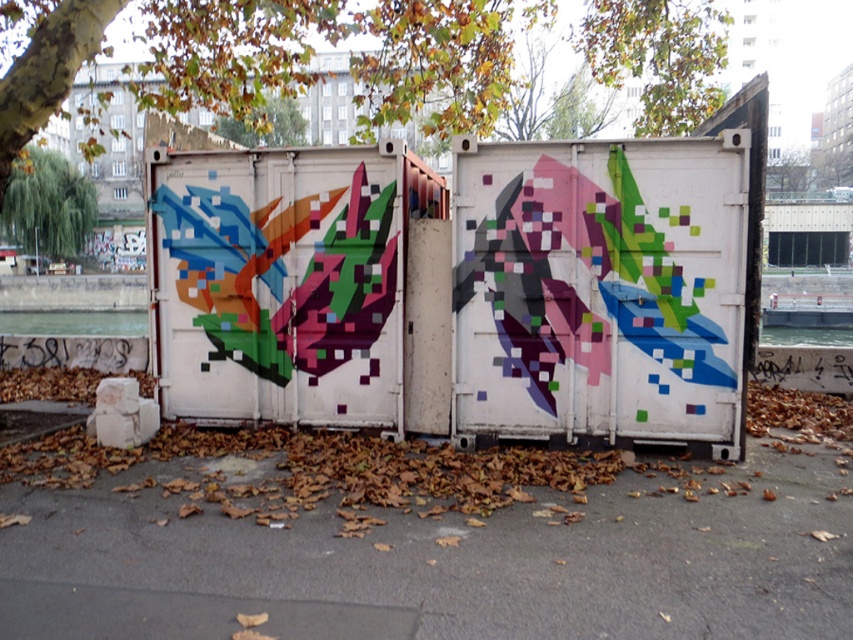
You are an urban planner reviewing this area. You notice the brown asphalt at center and the green leafy tree at left. Which object is positioned lower in the scene?

The brown asphalt at center is positioned lower than the green leafy tree at left.

You are standing at the edge of the paved area and want to walk to the brown asphalt at center. What direction should you head in to reach it?

The brown asphalt at center is located at point coordinates of [439,560], so you should head towards the center of the paved area to reach it.